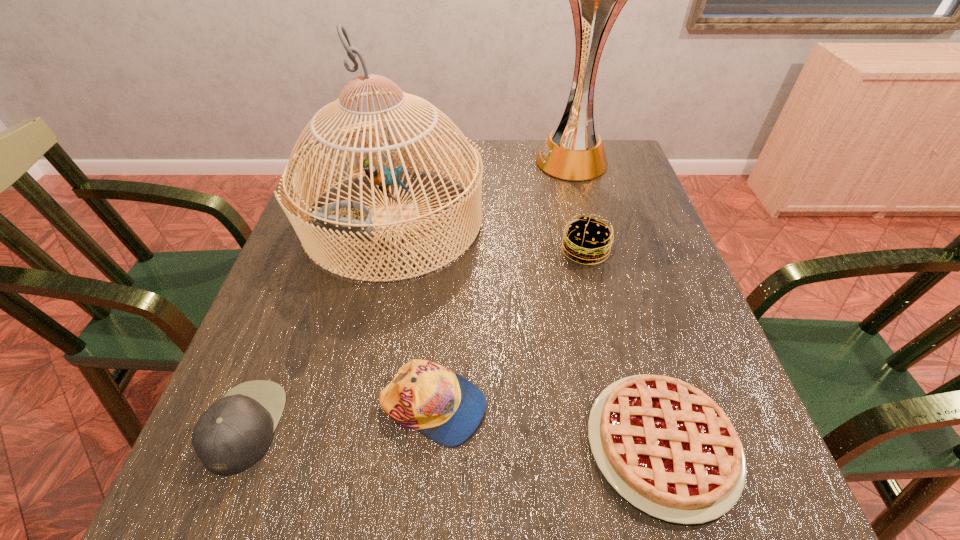
Find the location of `trophy`. trophy is located at coordinates (573, 151).

The height and width of the screenshot is (540, 960). In order to click on birdcage in this screenshot , I will do `click(347, 218)`.

You are a GUI agent. You are given a task and a screenshot of the screen. Output one action in this format:
    pyautogui.click(x=<x>, y=<y>)
    Task: Click on the patty
    The width and height of the screenshot is (960, 540).
    Given the screenshot: What is the action you would take?
    pyautogui.click(x=586, y=240)

This screenshot has width=960, height=540. I want to click on the right cap, so click(445, 407).

Locate an element on the screen. The height and width of the screenshot is (540, 960). the left cap is located at coordinates (230, 436).

Image resolution: width=960 pixels, height=540 pixels. I want to click on the shortest object, so click(666, 447).

Where is `blank space located 0.230m on the front-facing side of the trophy`? This screenshot has width=960, height=540. blank space located 0.230m on the front-facing side of the trophy is located at coordinates (458, 161).

You are a GUI agent. You are given a task and a screenshot of the screen. Output one action in this format:
    pyautogui.click(x=<x>, y=<y>)
    Task: Click on the vacant space situated 0.090m on the front-facing side of the trophy
    The height and width of the screenshot is (540, 960).
    Given the screenshot: What is the action you would take?
    pyautogui.click(x=505, y=161)

Identify the location of free space located 0.400m on the front-facing side of the trophy. (399, 161).

Where is `vacant space located on the front of the birdcage`? vacant space located on the front of the birdcage is located at coordinates (357, 384).